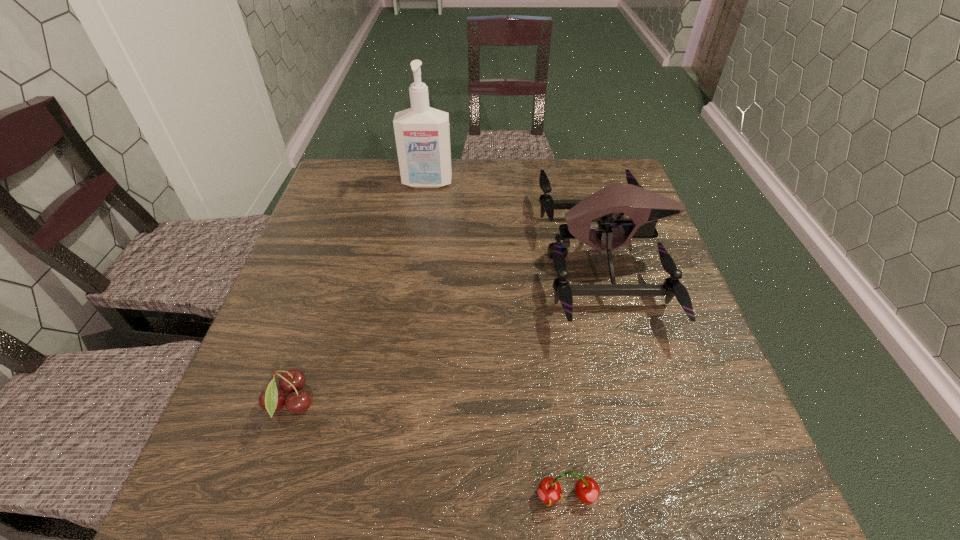
Where is `vacant position at the near edge of the desktop`? vacant position at the near edge of the desktop is located at coordinates (625, 490).

I want to click on free space at the left edge, so click(x=257, y=370).

I want to click on vacant space at the right edge, so click(x=657, y=447).

Find the location of a particular element. Image resolution: width=960 pixels, height=540 pixels. free space at the far left corner is located at coordinates (347, 175).

I want to click on vacant region at the far right corner of the desktop, so click(588, 159).

Where is `vacant area that lies between the right cherry and the tallest object`? Image resolution: width=960 pixels, height=540 pixels. vacant area that lies between the right cherry and the tallest object is located at coordinates (497, 340).

Find the location of a particular element. This screenshot has height=540, width=960. free space between the third shortest object and the third object from right to left is located at coordinates (516, 220).

Locate an element on the screen. The image size is (960, 540). empty space between the nearer cherry and the third nearest object is located at coordinates (586, 377).

You are a GUI agent. You are given a task and a screenshot of the screen. Output one action in this format:
    pyautogui.click(x=<x>, y=<y>)
    Task: Click on the free area in between the tallest object and the nearest object
    
    Given the screenshot: What is the action you would take?
    pyautogui.click(x=497, y=340)

This screenshot has width=960, height=540. I want to click on free space that is in between the second tallest object and the farther cherry, so click(447, 330).